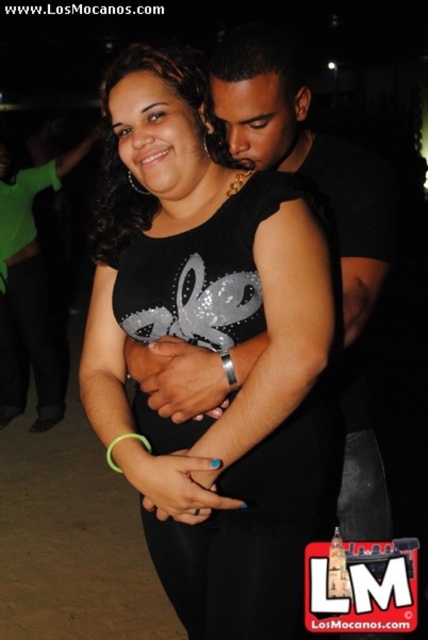
You are a photographer at a party and need to capture both the black sequined dress at center and the black matte shirt at upper right in a single frame. Which object should you focus on first to ensure both fit in the shot?

The black sequined dress at center is bigger than the black matte shirt at upper right, so you should focus on the black sequined dress at center first to ensure both fit in the shot.

You are taking a photo of the two dancers and want to focus on the point closer to the camera. Which point should you choose between point (139, 65) and point (80, 161)?

Point (139, 65) is closer to the camera than point (80, 161), so you should choose point (139, 65) to focus on.